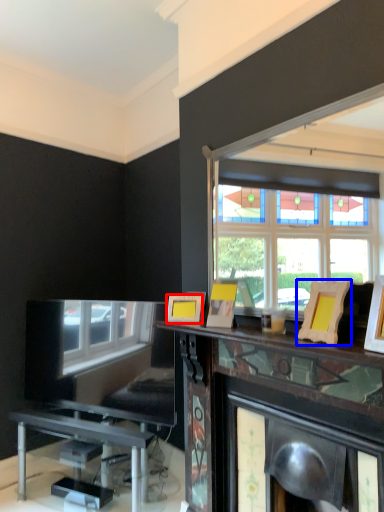
Question: Which object is closer to the camera taking this photo, picture frame (highlighted by a red box) or picture frame (highlighted by a blue box)?

Choices:
 (A) picture frame
 (B) picture frame

Answer: (B)